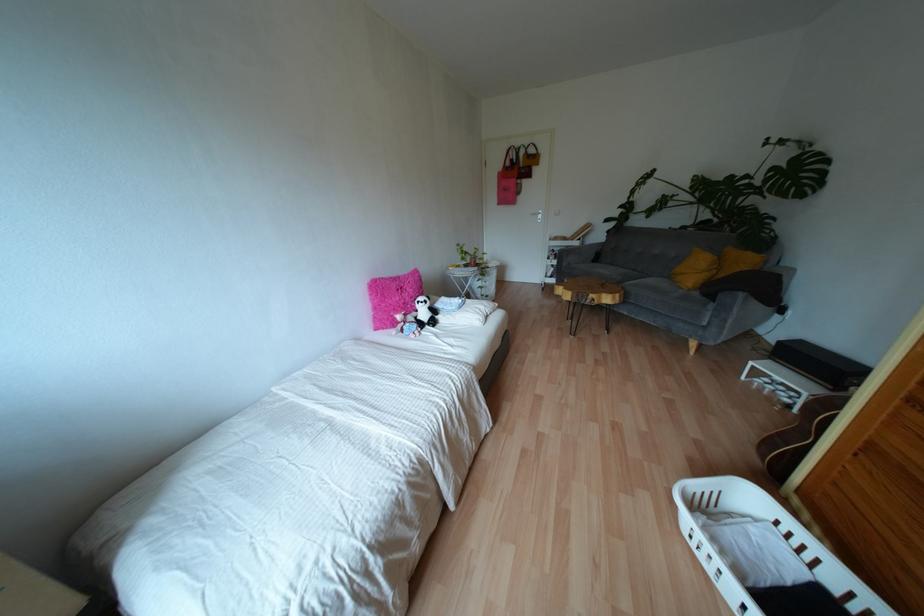
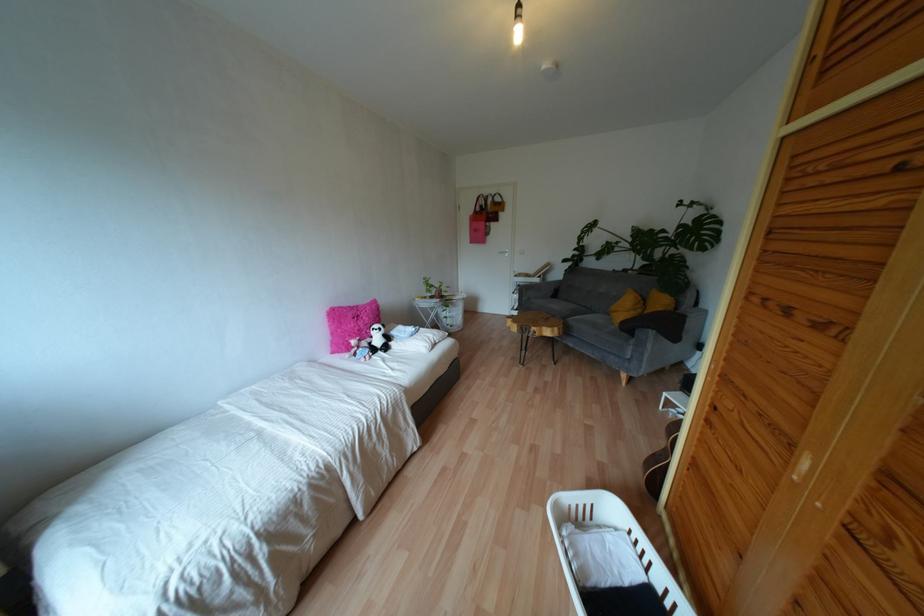
Question: I am providing you with two images of the same scene from different viewpoints. Which of the following objects are not visible in image2?

Choices:
 (A) gray sofa armrest
 (B) white pillow
 (C) white door handle
 (D) none of these

Answer: (D)